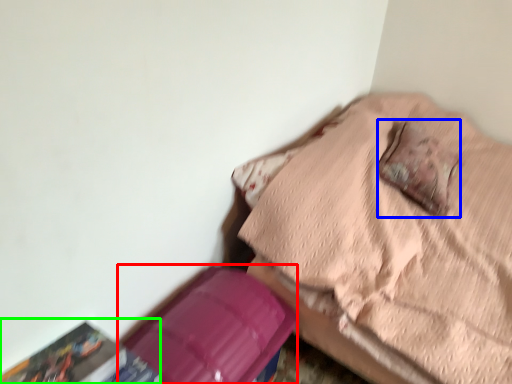
Question: Based on their relative distances, which object is nearer to cardboard box (highlighted by a red box)? Choose from pillow (highlighted by a blue box) and paperback book (highlighted by a green box).

Choices:
 (A) pillow
 (B) paperback book

Answer: (B)